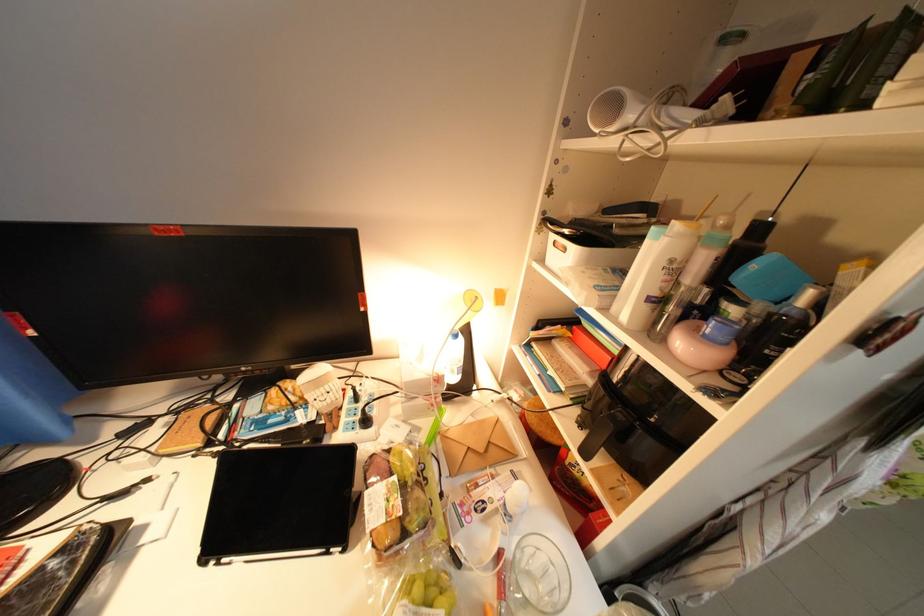
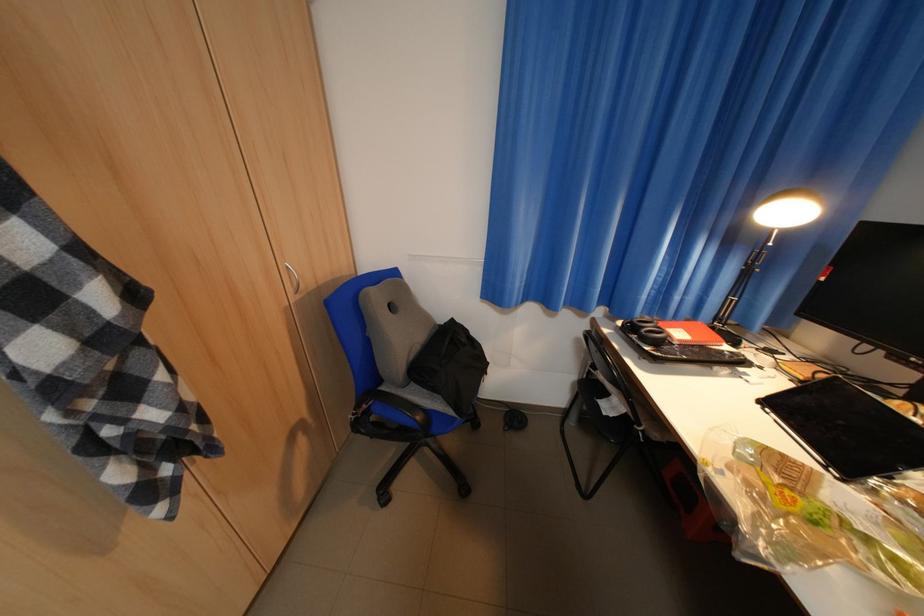
First-person continuous shooting, in which direction is the camera rotating?

The rotation direction of the camera is left-down.